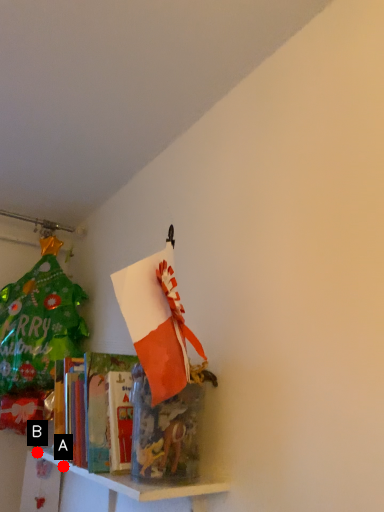
Question: Two points are circled on the image, labeled by A and B beside each circle. Which point is further to the camera?

Choices:
 (A) A is further
 (B) B is further

Answer: (B)